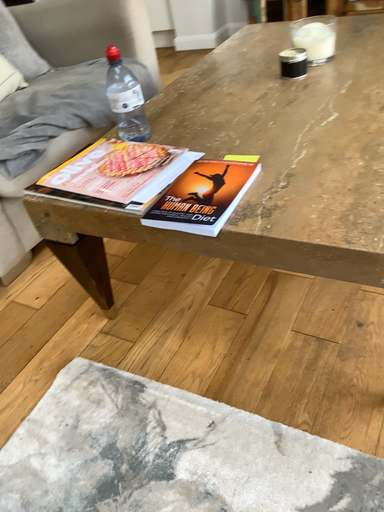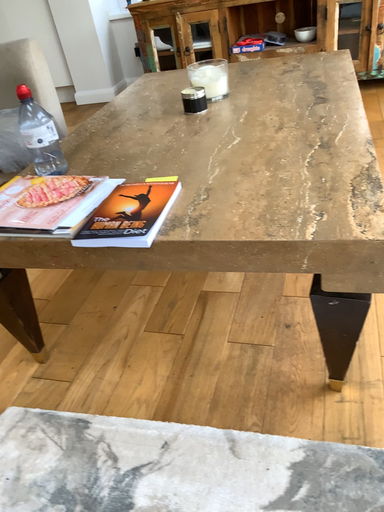
Question: Which way did the camera rotate in the video?

Choices:
 (A) rotated downward
 (B) rotated upward

Answer: (B)